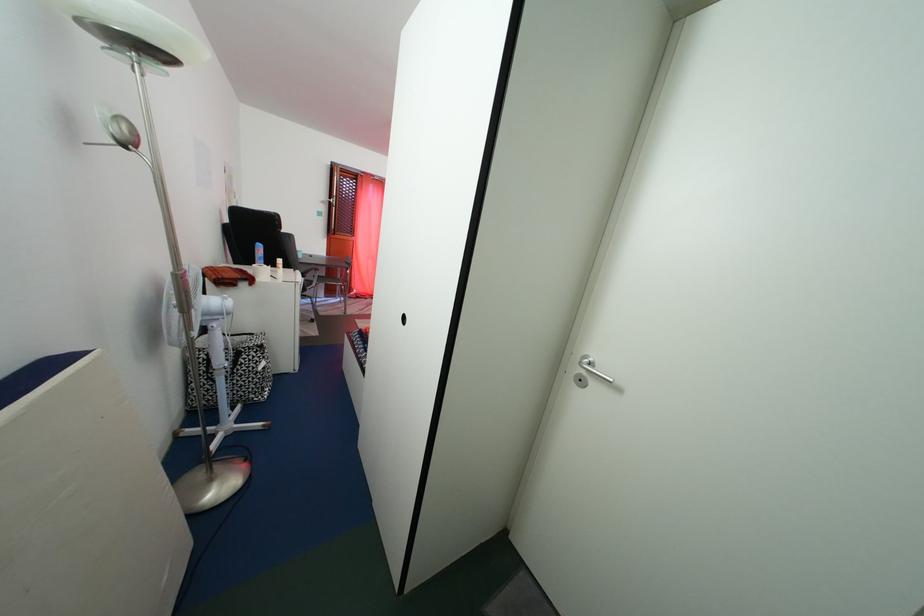
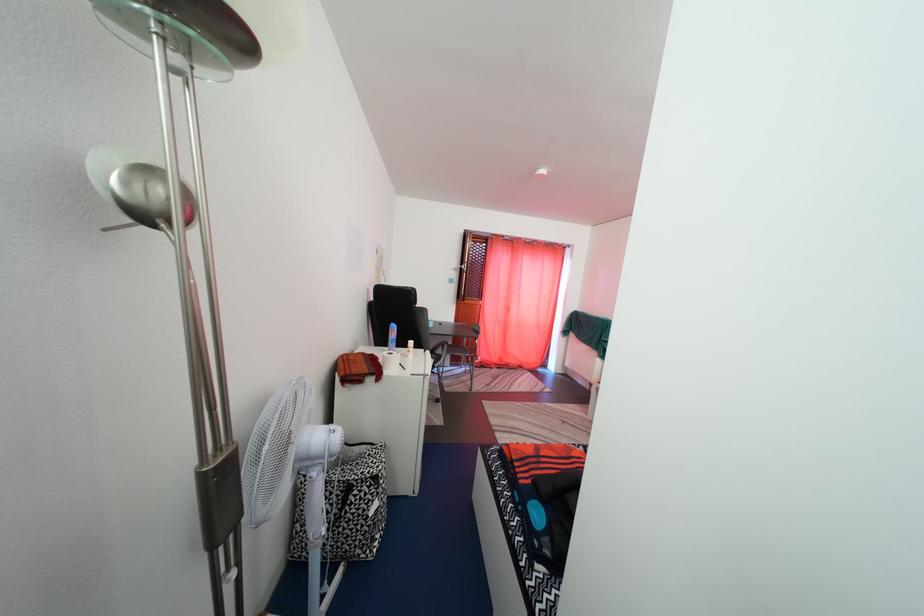
Find the pixel in the second image that matches the point at 319,284 in the first image.

(447, 359)